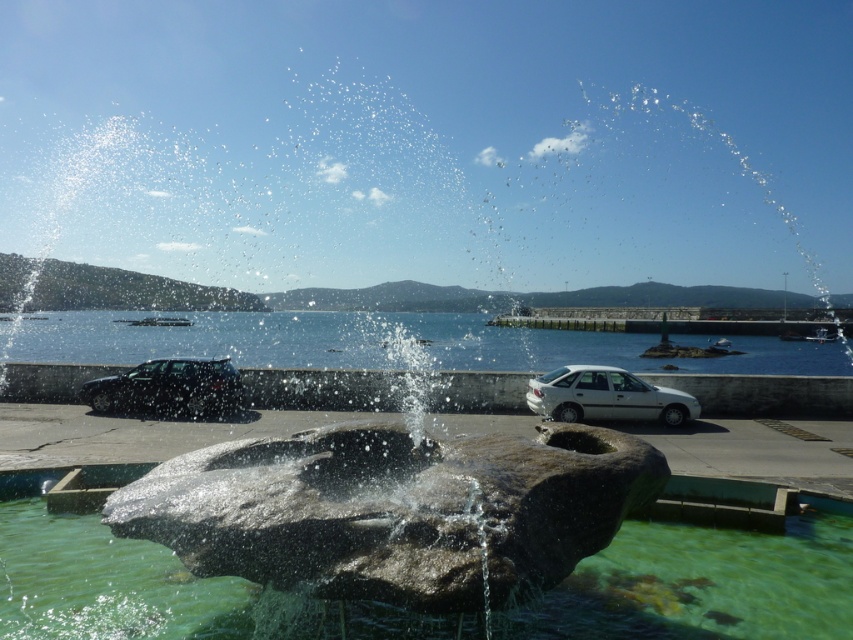
You are planning to take a photo of the metallic gray car at left and the rough stone fountain at center. Since you want both objects to appear equally prominent in the photo, which one should you zoom in on more?

Since the rough stone fountain at center is larger in size than the metallic gray car at left, you should zoom in more on the metallic gray car at left to make both appear equally prominent in the photo.

You are a pedestrian standing at the edge of the rough stone fountain at center. You want to walk to the silver metallic car at center. Which direction should you move to reach the car?

The rough stone fountain at center is in front of the silver metallic car at center, so you should move backward to reach the silver metallic car at center.